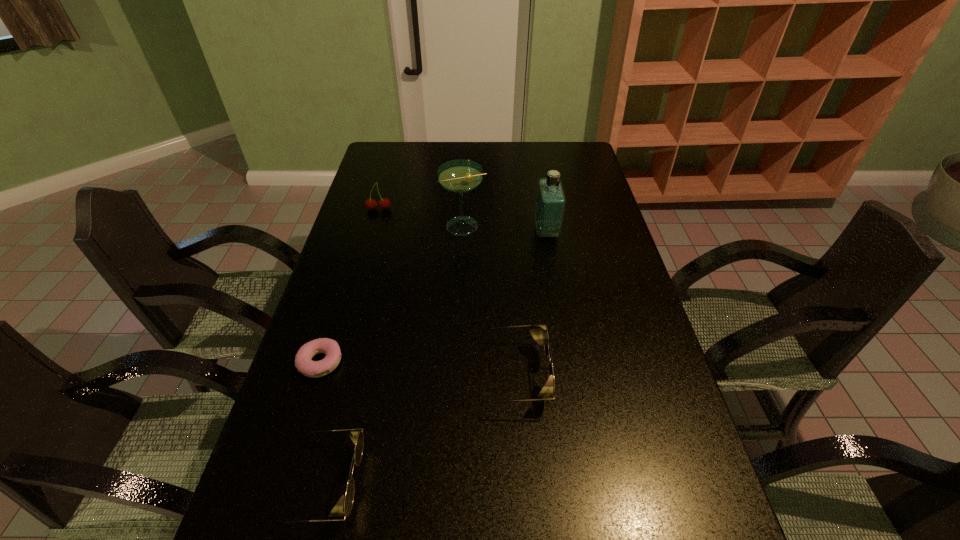
The width and height of the screenshot is (960, 540). I want to click on object located in the near left corner section of the desktop, so click(356, 436).

At what (x,y) coordinates should I click in order to perform the action: click on free space at the far edge of the desktop. Please return your answer as a coordinate pair (x, y). The image size is (960, 540). Looking at the image, I should click on pyautogui.click(x=477, y=154).

Where is `free region at the left edge of the desktop`? The image size is (960, 540). free region at the left edge of the desktop is located at coordinates (351, 342).

This screenshot has height=540, width=960. In order to click on vacant space at the right edge in this screenshot , I will do `click(654, 411)`.

The height and width of the screenshot is (540, 960). In the image, there is a desktop. Find the location of `vacant space at the far right corner`. vacant space at the far right corner is located at coordinates (593, 167).

The height and width of the screenshot is (540, 960). Find the location of `vacant space at the near right corner`. vacant space at the near right corner is located at coordinates (689, 491).

At what (x,y) coordinates should I click in order to perform the action: click on vacant region between the right sunglasses and the shorter sunglasses. Please return your answer as a coordinate pair (x, y). The height and width of the screenshot is (540, 960). Looking at the image, I should click on (416, 430).

In order to click on vacant space that's between the farther sunglasses and the perfume in this screenshot , I will do `click(528, 304)`.

Find the location of a particular element. Image resolution: width=960 pixels, height=540 pixels. free space between the martini and the rightmost object is located at coordinates (505, 229).

Find the location of `free space between the martini and the farther sunglasses`. free space between the martini and the farther sunglasses is located at coordinates (486, 301).